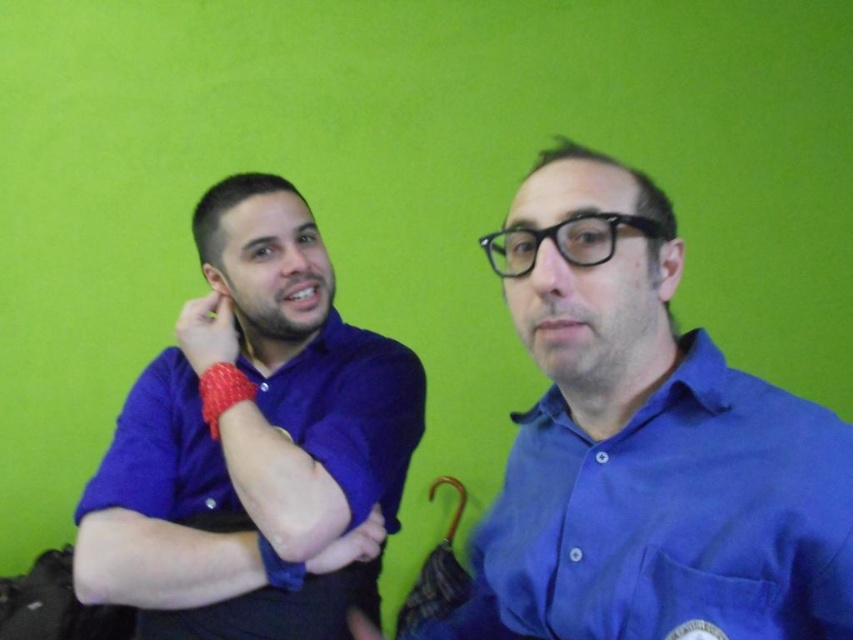
Question: Which object appears closest to the camera in this image?

Choices:
 (A) matte blue shirt at left
 (B) rubber band at left
 (C) blue cotton shirt at center

Answer: (C)

Question: Which point is closer to the camera?

Choices:
 (A) blue cotton shirt at center
 (B) rubber band at left
 (C) matte blue shirt at left

Answer: (A)

Question: Does blue cotton shirt at center appear on the right side of rubber band at left?

Choices:
 (A) no
 (B) yes

Answer: (B)

Question: Is blue cotton shirt at center closer to camera compared to matte blue shirt at left?

Choices:
 (A) yes
 (B) no

Answer: (A)

Question: Which of these objects is positioned farthest from the matte blue shirt at left?

Choices:
 (A) rubber band at left
 (B) blue cotton shirt at center

Answer: (B)

Question: Can you confirm if blue cotton shirt at center is positioned to the left of matte blue shirt at left?

Choices:
 (A) no
 (B) yes

Answer: (A)